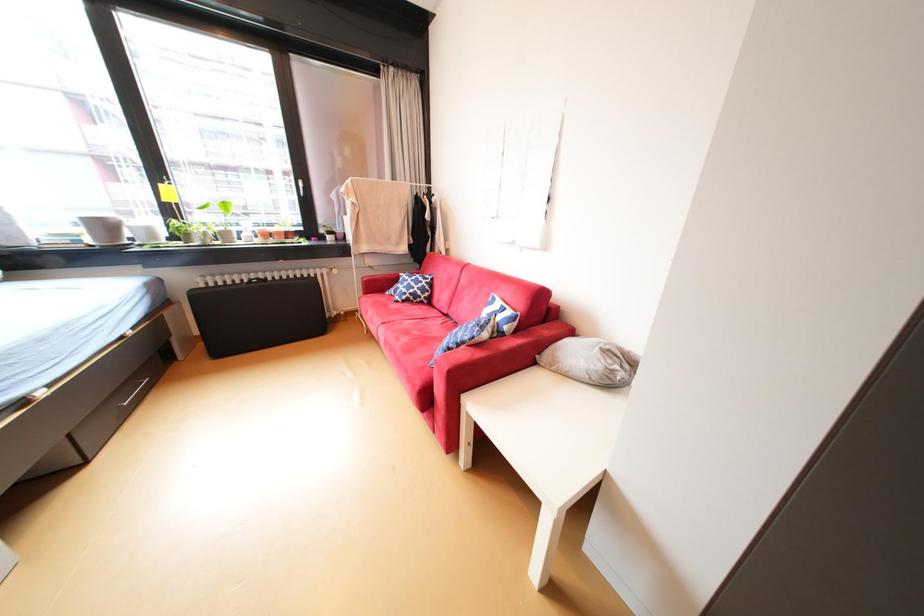
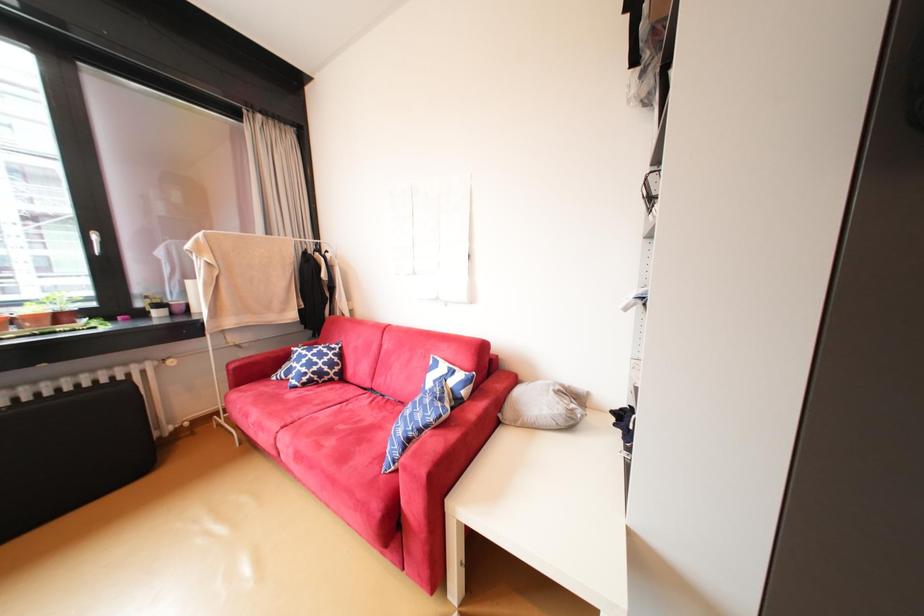
Question: The camera is either moving clockwise (left) or counter-clockwise (right) around the object. The first image is from the beginning of the video and the second image is from the end. Is the camera moving left or right when shooting the video?

Choices:
 (A) Left
 (B) Right

Answer: (A)